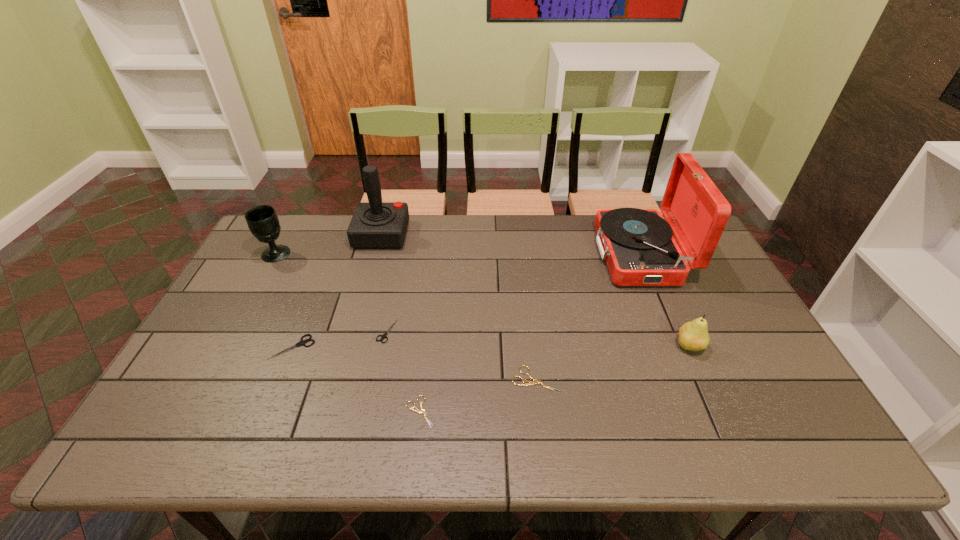
Where is `shears that is the third closest to the phonograph_record`? The image size is (960, 540). shears that is the third closest to the phonograph_record is located at coordinates (384, 335).

Identify the location of free space that satisfies the following two spatial constraints: 1. on the front side of the right beige shears; 2. on the left side of the chalice. (207, 380).